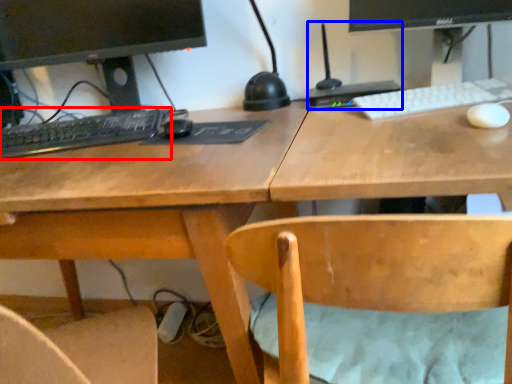
Question: Among these objects, which one is farthest to the camera, computer keyboard (highlighted by a red box) or computer (highlighted by a blue box)?

Choices:
 (A) computer keyboard
 (B) computer

Answer: (B)